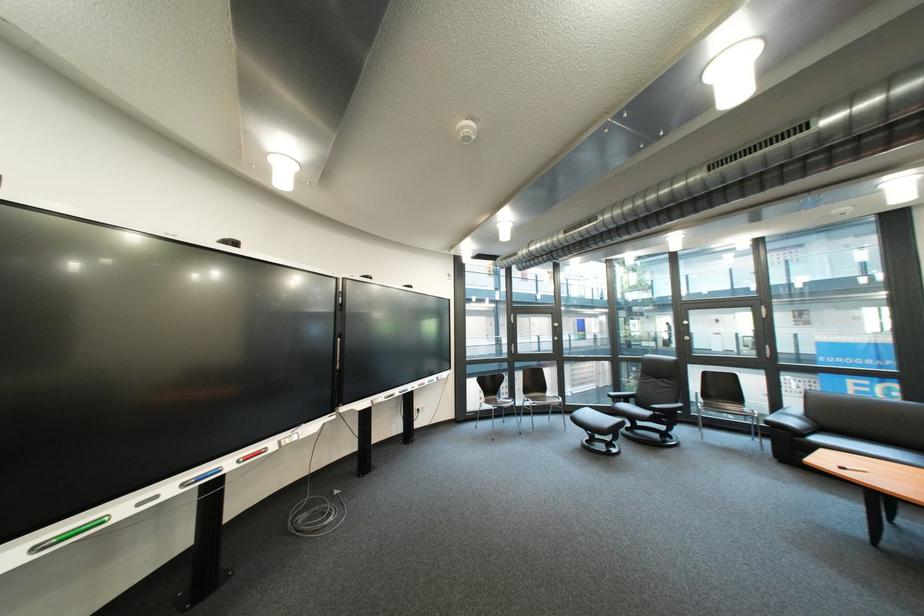
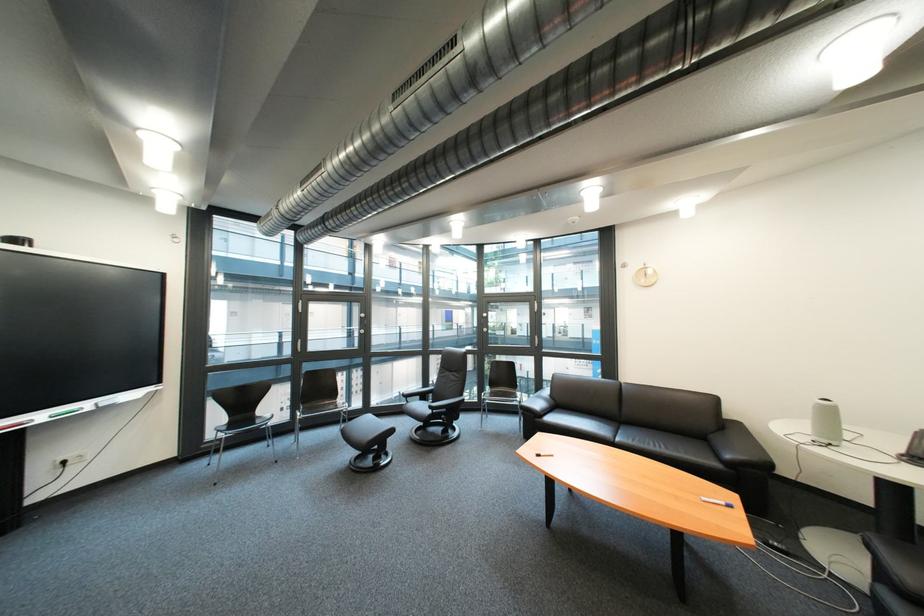
The point at [567,415] is marked in the first image. Where is the corresponding point in the second image?

(359, 424)